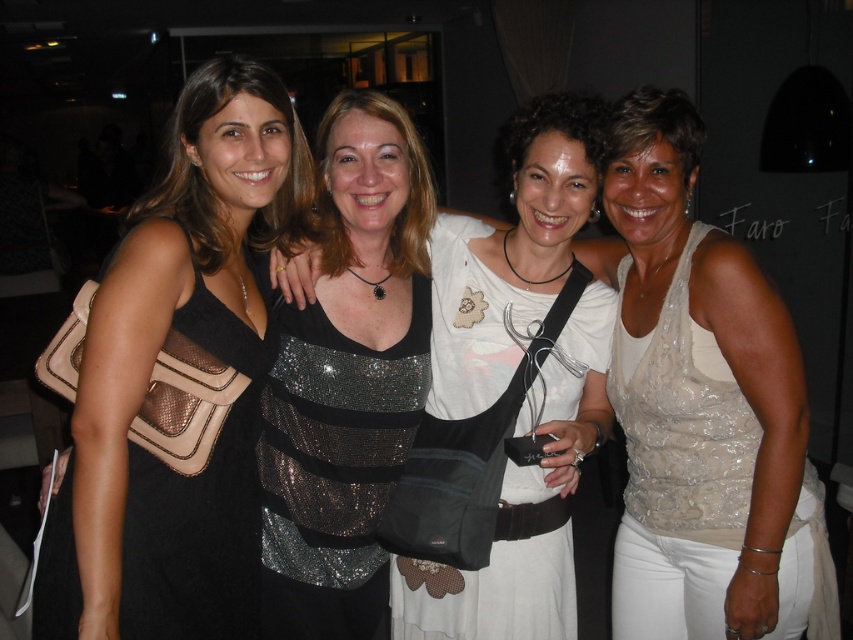
Which dress is larger in size between the sparkly silver dress at center and the sparkly sequined dress at center?

The sparkly silver dress at center is bigger than the sparkly sequined dress at center.

Please identify the coordinates of the white sheer dress at center in the image. The coordinates should be in the format of a point with two decimal places, like point [473,321]. Answer with nothing else.

The white sheer dress at center is represented by point [473,321].